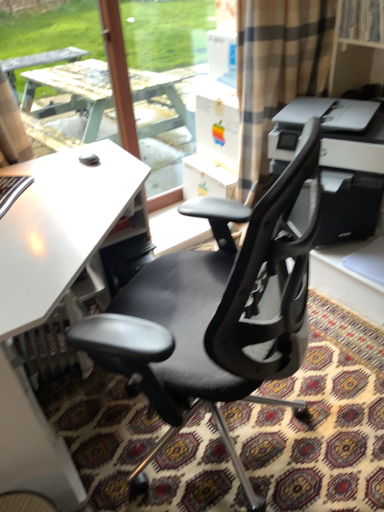
Question: Is white matte desk at center to the left of white plastic printer at upper right from the viewer's perspective?

Choices:
 (A) no
 (B) yes

Answer: (B)

Question: Would you say white matte desk at center is outside white plastic printer at upper right?

Choices:
 (A) no
 (B) yes

Answer: (B)

Question: Is white matte desk at center oriented away from white plastic printer at upper right?

Choices:
 (A) yes
 (B) no

Answer: (B)

Question: Is white plastic printer at upper right surrounded by white matte desk at center?

Choices:
 (A) yes
 (B) no

Answer: (B)

Question: Is white matte desk at center facing towards white plastic printer at upper right?

Choices:
 (A) yes
 (B) no

Answer: (B)

Question: Can you confirm if white matte desk at center is taller than white plastic printer at upper right?

Choices:
 (A) yes
 (B) no

Answer: (A)

Question: From a real-world perspective, is white plastic printer at upper right on top of white matte desk at center?

Choices:
 (A) no
 (B) yes

Answer: (B)

Question: Considering the relative sizes of white plastic printer at upper right and white matte desk at center in the image provided, is white plastic printer at upper right smaller than white matte desk at center?

Choices:
 (A) no
 (B) yes

Answer: (B)

Question: From the image's perspective, would you say white plastic printer at upper right is positioned over white matte desk at center?

Choices:
 (A) no
 (B) yes

Answer: (B)

Question: Considering the relative sizes of white plastic printer at upper right and white matte desk at center in the image provided, is white plastic printer at upper right wider than white matte desk at center?

Choices:
 (A) no
 (B) yes

Answer: (A)

Question: From the image's perspective, would you say white plastic printer at upper right is shown under white matte desk at center?

Choices:
 (A) yes
 (B) no

Answer: (B)

Question: Considering the relative sizes of white plastic printer at upper right and white matte desk at center in the image provided, is white plastic printer at upper right shorter than white matte desk at center?

Choices:
 (A) no
 (B) yes

Answer: (B)

Question: Does white matte desk at center have a greater width compared to black mesh office chair at center?

Choices:
 (A) no
 (B) yes

Answer: (B)